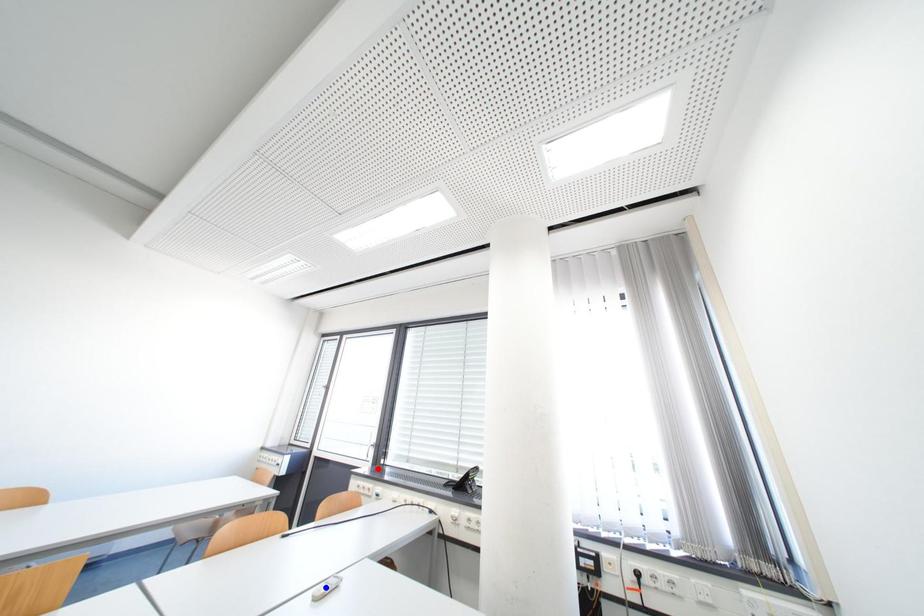
Question: Which of the two points in the image is closer to the camera?

Choices:
 (A) Blue point is closer.
 (B) Red point is closer.

Answer: (A)